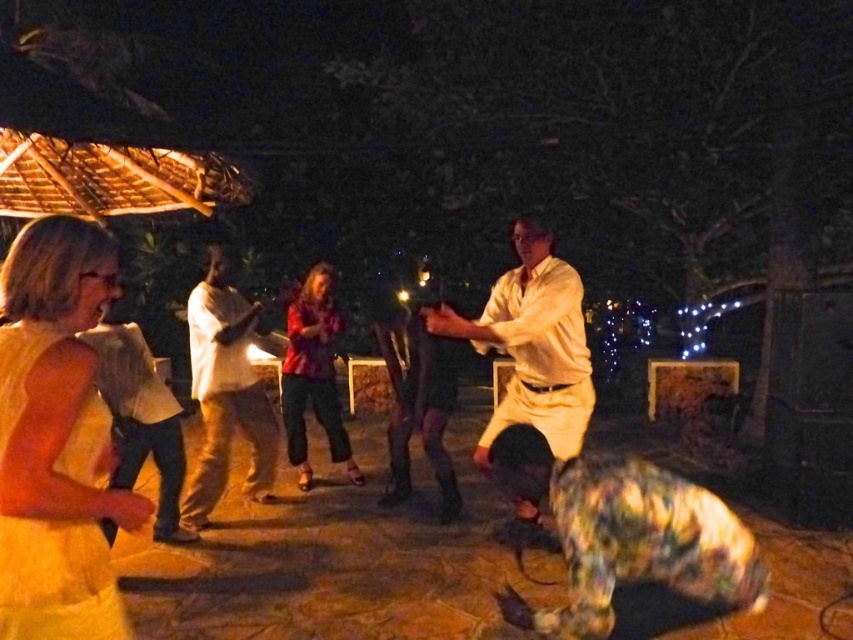
Can you confirm if light beige cotton shirt at center is thinner than light brown leather jacket at left?

No.

Is light beige cotton shirt at center shorter than light brown leather jacket at left?

No.

At what (x,y) coordinates should I click in order to perform the action: click on light beige cotton shirt at center. Please return your answer as a coordinate pair (x, y). The image size is (853, 640). Looking at the image, I should click on click(532, 342).

Can you confirm if yellow fabric dress at lower left is wider than light beige cotton shirt at center?

No, yellow fabric dress at lower left is not wider than light beige cotton shirt at center.

Who is more forward, (88, 493) or (527, 349)?

Point (88, 493) is more forward.

Where is `yellow fabric dress at lower left`? yellow fabric dress at lower left is located at coordinates (56, 438).

In order to click on yellow fabric dress at lower left in this screenshot , I will do `click(56, 438)`.

Who is more distant from viewer, (225, 328) or (328, 336)?

Point (328, 336)

Is light brown cotton shirt at center thinner than printed cotton blouse at center?

No.

Describe the element at coordinates (225, 394) in the screenshot. I see `light brown cotton shirt at center` at that location.

Identify the location of light brown cotton shirt at center. The image size is (853, 640). (225, 394).